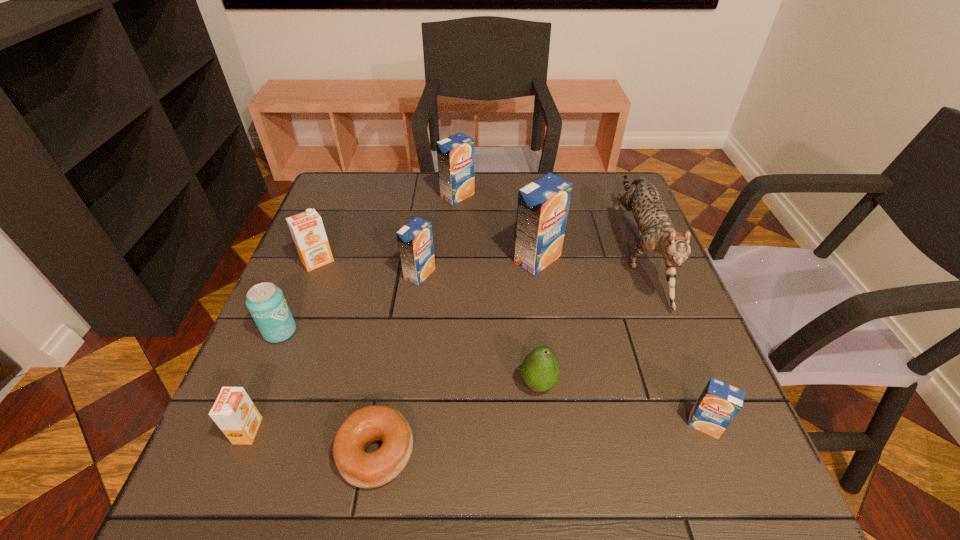
The height and width of the screenshot is (540, 960). Find the location of `vacant area that lies between the avocado and the nearer orange orange juice`. vacant area that lies between the avocado and the nearer orange orange juice is located at coordinates (394, 407).

Locate an element on the screen. vacant area between the sixth farthest object and the farthest orange juice is located at coordinates (369, 264).

Locate an element on the screen. This screenshot has height=540, width=960. empty location between the third biggest blue orange_juice and the avocado is located at coordinates (479, 329).

The height and width of the screenshot is (540, 960). What are the coordinates of `empty space that is in between the bigger orange orange juice and the shortest object` in the screenshot? It's located at (348, 357).

The width and height of the screenshot is (960, 540). Identify the location of vacant area that lies between the second smallest blue orange_juice and the sixth farthest object. (350, 303).

The image size is (960, 540). I want to click on free space between the farther orange orange juice and the smaller orange orange juice, so tap(283, 346).

The image size is (960, 540). Identify the location of free space between the smaller orange orange juice and the bagel. (312, 442).

Find the location of a particular element. This screenshot has width=960, height=540. object that is the eighth closest to the nearest blue orange_juice is located at coordinates (266, 303).

Identify the location of object that can be found as the sixth closest to the cat. (376, 423).

Where is `orange juice that can be found as the third closest to the rightmost orange juice`? This screenshot has height=540, width=960. orange juice that can be found as the third closest to the rightmost orange juice is located at coordinates (455, 154).